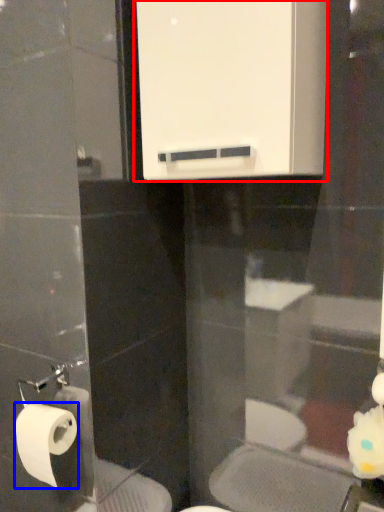
Question: Which point is further to the camera, medicine cabinet (highlighted by a red box) or toilet paper (highlighted by a blue box)?

Choices:
 (A) medicine cabinet
 (B) toilet paper

Answer: (B)